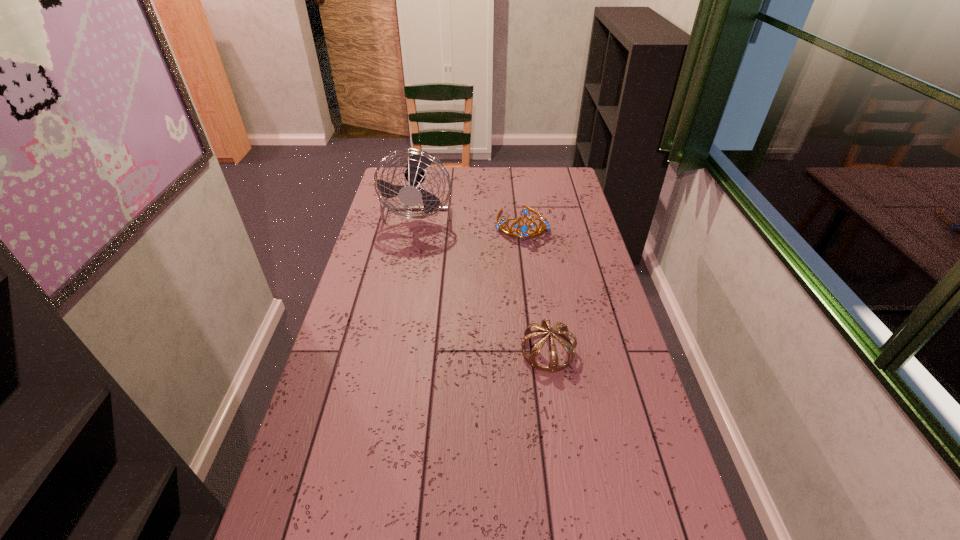
You are a GUI agent. You are given a task and a screenshot of the screen. Output one action in this format:
    pyautogui.click(x=<x>, y=<y>)
    Task: Click on the vacant region between the shortest object and the taller tiara
    
    Given the screenshot: What is the action you would take?
    pyautogui.click(x=535, y=287)

This screenshot has height=540, width=960. In order to click on object that is the second closest to the second shortest object in this screenshot , I will do `click(545, 327)`.

Identify the location of object that is the second nearest to the leftmost object. (545, 327).

Where is `vacant space that satisfies the following two spatial constraints: 1. on the front-facing side of the nearer tiara; 2. on the left side of the tallest object`? This screenshot has width=960, height=540. vacant space that satisfies the following two spatial constraints: 1. on the front-facing side of the nearer tiara; 2. on the left side of the tallest object is located at coordinates (393, 352).